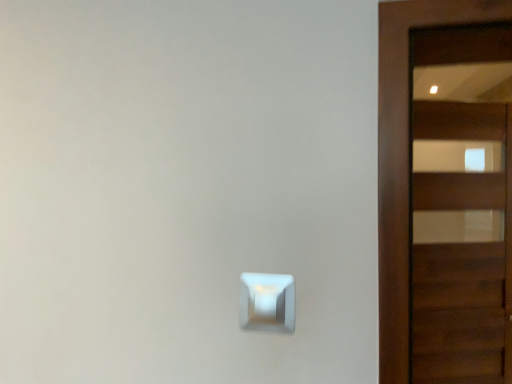
Find the location of a particular element. Image resolution: width=512 pixels, height=384 pixels. white glossy light switch at center is located at coordinates (267, 302).

Measure the distance between white glossy light switch at center and camera.

white glossy light switch at center is 37.83 inches away from camera.

The height and width of the screenshot is (384, 512). What do you see at coordinates (267, 302) in the screenshot?
I see `white glossy light switch at center` at bounding box center [267, 302].

Find the location of a particular element. wooden door at right is located at coordinates (405, 159).

Measure the distance between point (403, 142) and camera.

Point (403, 142) is 34.92 inches from camera.

The height and width of the screenshot is (384, 512). What do you see at coordinates (405, 159) in the screenshot?
I see `wooden door at right` at bounding box center [405, 159].

The image size is (512, 384). What are the coordinates of `white glossy light switch at center` in the screenshot? It's located at (267, 302).

Which object is positioned more to the right, wooden door at right or white glossy light switch at center?

wooden door at right is more to the right.

Consider the image. Which object is closer to the camera taking this photo, wooden door at right or white glossy light switch at center?

Positioned in front is white glossy light switch at center.

Which is farther from the camera, (399, 263) or (263, 289)?

The point (263, 289) is more distant.

From the image's perspective, relative to white glossy light switch at center, is wooden door at right above or below?

Clearly, from the image's perspective, wooden door at right is above white glossy light switch at center.

From a real-world perspective, is wooden door at right positioned above or below white glossy light switch at center?

In terms of real-world spatial position, wooden door at right is above white glossy light switch at center.

Considering the relative sizes of wooden door at right and white glossy light switch at center in the image provided, is wooden door at right thinner than white glossy light switch at center?

In fact, wooden door at right might be wider than white glossy light switch at center.

Which of these two, wooden door at right or white glossy light switch at center, stands shorter?

Standing shorter between the two is white glossy light switch at center.

Which of these two, wooden door at right or white glossy light switch at center, is smaller?

white glossy light switch at center is smaller.

Is wooden door at right not inside white glossy light switch at center?

Absolutely, wooden door at right is external to white glossy light switch at center.

Is wooden door at right far away from white glossy light switch at center?

No, wooden door at right is not far from white glossy light switch at center.

In the scene shown: Is wooden door at right aimed at white glossy light switch at center?

No, wooden door at right is not facing towards white glossy light switch at center.

How many degrees apart are the facing directions of wooden door at right and white glossy light switch at center?

12.3 degrees separate the facing orientations of wooden door at right and white glossy light switch at center.

Where is `light switch to the left of wooden door at right`? light switch to the left of wooden door at right is located at coordinates (267, 302).

Is white glossy light switch at center to the left of wooden door at right from the viewer's perspective?

Yes, white glossy light switch at center is to the left of wooden door at right.

Is white glossy light switch at center behind wooden door at right?

No, the depth of white glossy light switch at center is less than that of wooden door at right.

Which is behind, point (258, 322) or point (390, 72)?

The point (258, 322) is farther from the camera.

Consider the image. From the image's perspective, relative to wooden door at right, is white glossy light switch at center above or below?

white glossy light switch at center is below wooden door at right.

From a real-world perspective, relative to wooden door at right, is white glossy light switch at center vertically above or below?

Clearly, from a real-world perspective, white glossy light switch at center is below wooden door at right.

Which object is thinner, white glossy light switch at center or wooden door at right?

white glossy light switch at center.

From their relative heights in the image, would you say white glossy light switch at center is taller or shorter than wooden door at right?

Considering their sizes, white glossy light switch at center has less height than wooden door at right.

From the picture: Considering the relative sizes of white glossy light switch at center and wooden door at right in the image provided, is white glossy light switch at center bigger than wooden door at right?

Actually, white glossy light switch at center might be smaller than wooden door at right.

Is wooden door at right surrounded by white glossy light switch at center?

No.

Is white glossy light switch at center touching wooden door at right?

No, white glossy light switch at center is not touching wooden door at right.

Is white glossy light switch at center aimed at wooden door at right?

No, white glossy light switch at center does not turn towards wooden door at right.

The width and height of the screenshot is (512, 384). There is a white glossy light switch at center. Identify the location of door above it (from a real-world perspective). (405, 159).

At what (x,y) coordinates should I click in order to perform the action: click on light switch located in front of the wooden door at right. Please return your answer as a coordinate pair (x, y). Looking at the image, I should click on (x=267, y=302).

This screenshot has height=384, width=512. Identify the location of door above the white glossy light switch at center (from a real-world perspective). (405, 159).